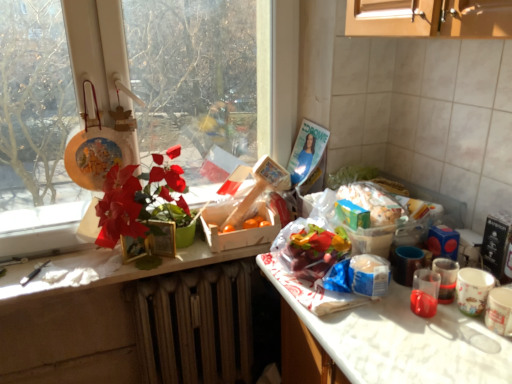
Question: From a real-world perspective, relative to translucent plastic container at center, is brown textured radiator at lower center vertically above or below?

Choices:
 (A) above
 (B) below

Answer: (B)

Question: Is brown textured radiator at lower center in front of or behind translucent plastic container at center in the image?

Choices:
 (A) behind
 (B) front

Answer: (A)

Question: Considering the real-world distances, which object is closest to the matte plastic flower at left?

Choices:
 (A) translucent plastic container at center
 (B) smooth wooden counter at center
 (C) transparent glass window at upper left
 (D) brown textured radiator at lower center
 (E) translucent plastic cup at right, the 2th coffee cup when ordered from left to right

Answer: (B)

Question: Considering the real-world distances, which object is closest to the smooth wooden counter at center?

Choices:
 (A) matte plastic flower at left
 (B) transparent glass window at upper left
 (C) transparent plastic cup at lower right, the second coffee cup in the right-to-left sequence
 (D) translucent plastic cup at right, the 2th coffee cup when ordered from left to right
 (E) translucent plastic container at center

Answer: (A)